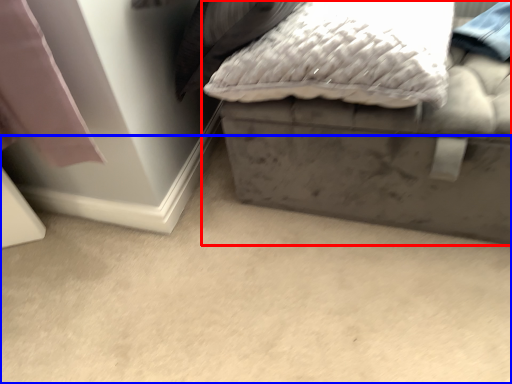
Question: Which point is closer to the camera, furniture (highlighted by a red box) or concrete (highlighted by a blue box)?

Choices:
 (A) furniture
 (B) concrete

Answer: (B)